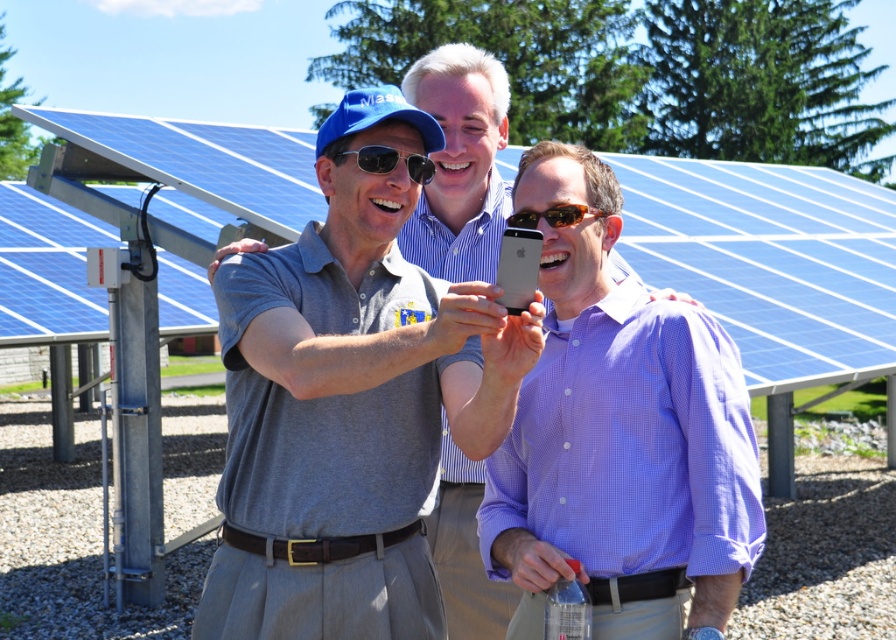
Question: Which object is farther from the camera taking this photo?

Choices:
 (A) blue solar panel at center
 (B) matte black sunglasses at center
 (C) matte gray shirt at center
 (D) purple checkered shirt at center

Answer: (A)

Question: Is blue solar panel at center wider than matte gray shirt at center?

Choices:
 (A) no
 (B) yes

Answer: (B)

Question: Can you confirm if matte black sunglasses at center is thinner than brown reflective sunglasses at center?

Choices:
 (A) yes
 (B) no

Answer: (A)

Question: Which object appears farthest from the camera in this image?

Choices:
 (A) blue solar panel at center
 (B) matte gray shirt at center

Answer: (A)

Question: Which object appears closest to the camera in this image?

Choices:
 (A) purple checkered shirt at center
 (B) blue solar panel at center

Answer: (A)

Question: Does matte black sunglasses at center appear over brown reflective sunglasses at center?

Choices:
 (A) yes
 (B) no

Answer: (A)